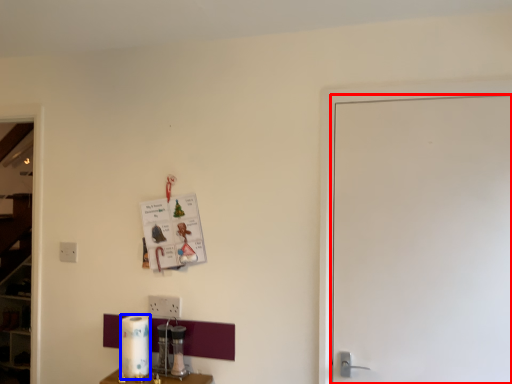
Question: Which object is closer to the camera taking this photo, door (highlighted by a red box) or paper towel (highlighted by a blue box)?

Choices:
 (A) door
 (B) paper towel

Answer: (A)